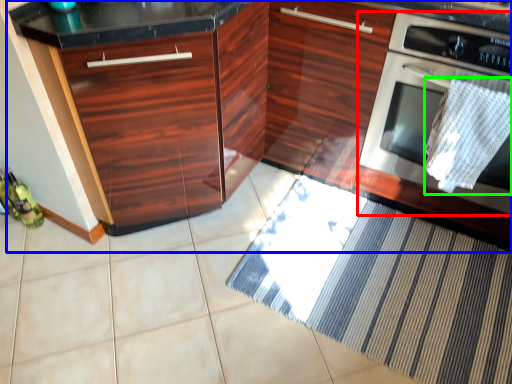
Question: Estimate the real-world distances between objects in this image. Which object is farther from home appliance (highlighted by a red box), cabinetry (highlighted by a blue box) or blanket (highlighted by a green box)?

Choices:
 (A) cabinetry
 (B) blanket

Answer: (A)